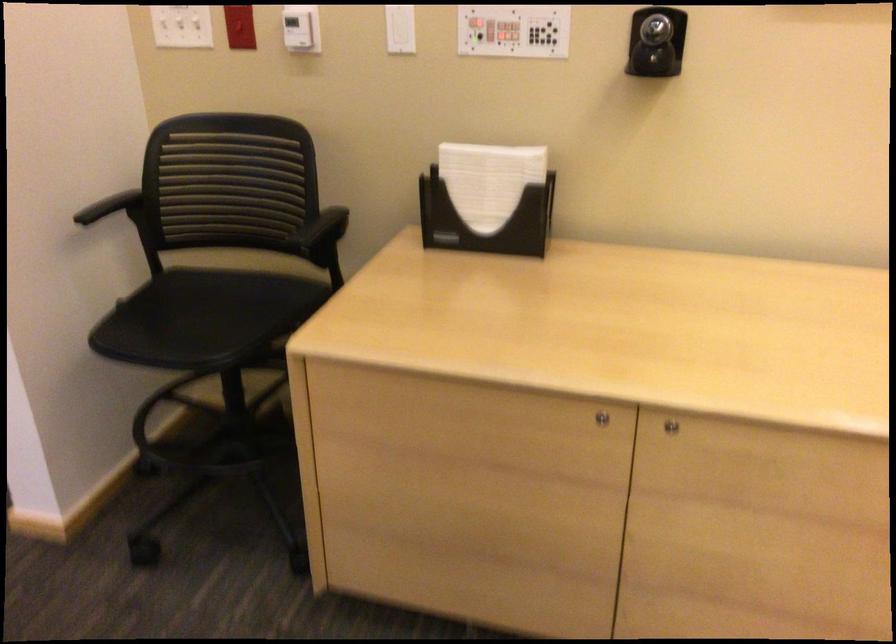
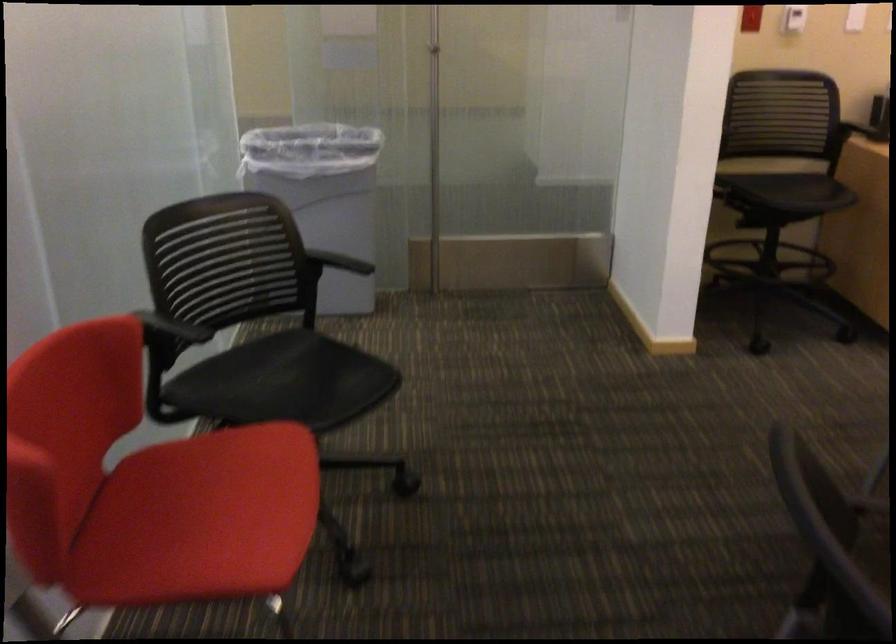
Question: I am providing you with two images of the same scene from different viewpoints. Please identify which objects are invisible in image2.

Choices:
 (A) red chair sitting surface
 (B) chair armrest
 (C) grey trash can
 (D) silver door latch

Answer: (B)